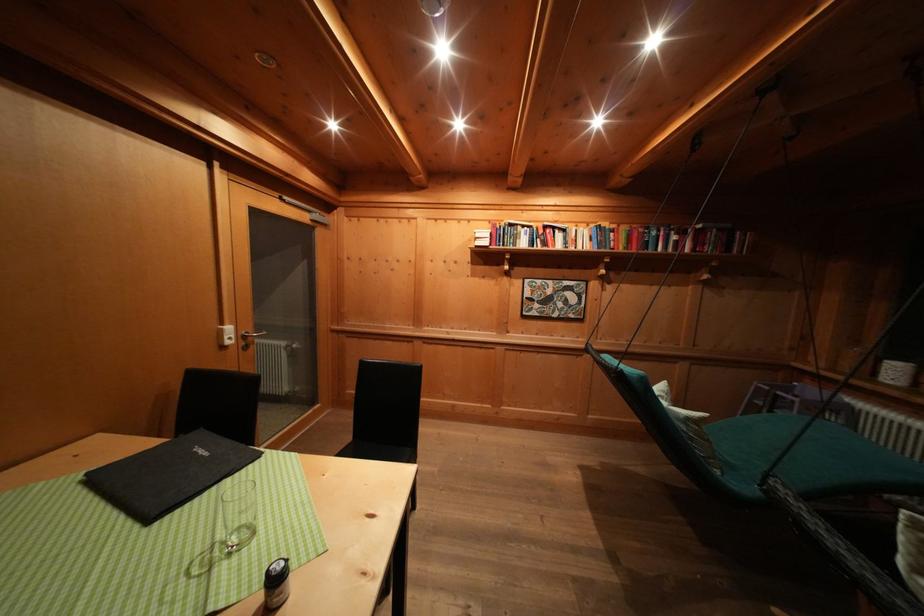
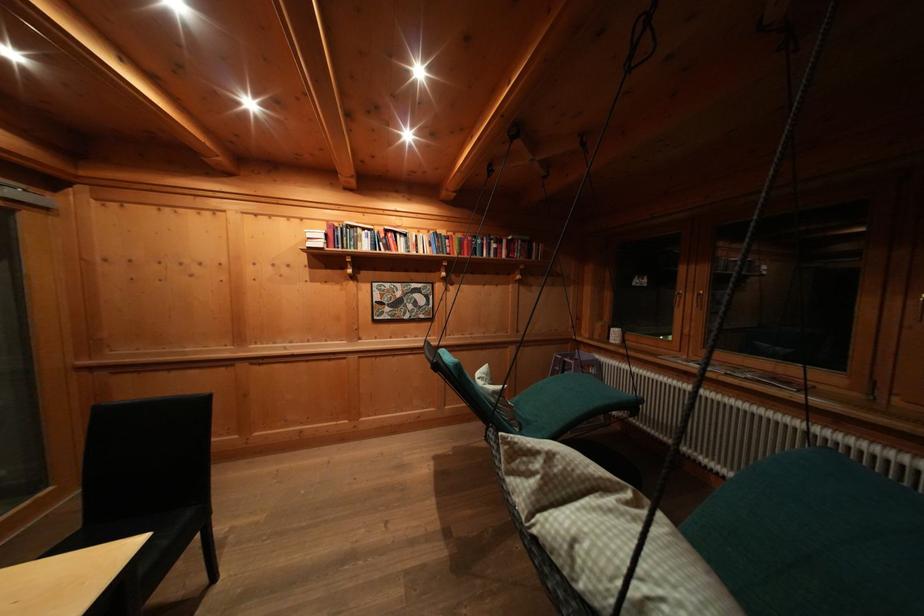
Question: The images are taken continuously from a first-person perspective. In which direction are you moving?

Choices:
 (A) Left
 (B) Right
 (C) Forward
 (D) Backward

Answer: (B)